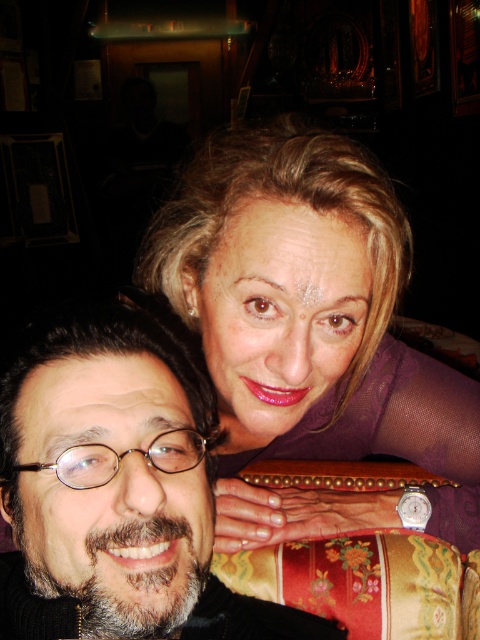
You are standing in a dimly lit indoor setting, possibly a cafe or restaurant. You notice a specific point in the scene at coordinates point (x=373, y=442). If you want to reach this point with your hand, which is 24 inches long, can you do so without moving your body?

The point (x=373, y=442) is 32.71 inches away from the viewer. Since your hand is only 24 inches long, you cannot reach it without moving your body.

You are standing in the same room as the two people in the image. You want to move from the point marked at coordinate (175, 200) to the point marked at coordinate (143, 598). Is the path between them clear of any obstacles?

The path between point (175, 200) and point (143, 598) is clear because point (175, 200) is behind point (143, 598), so there are no objects blocking the path between them.